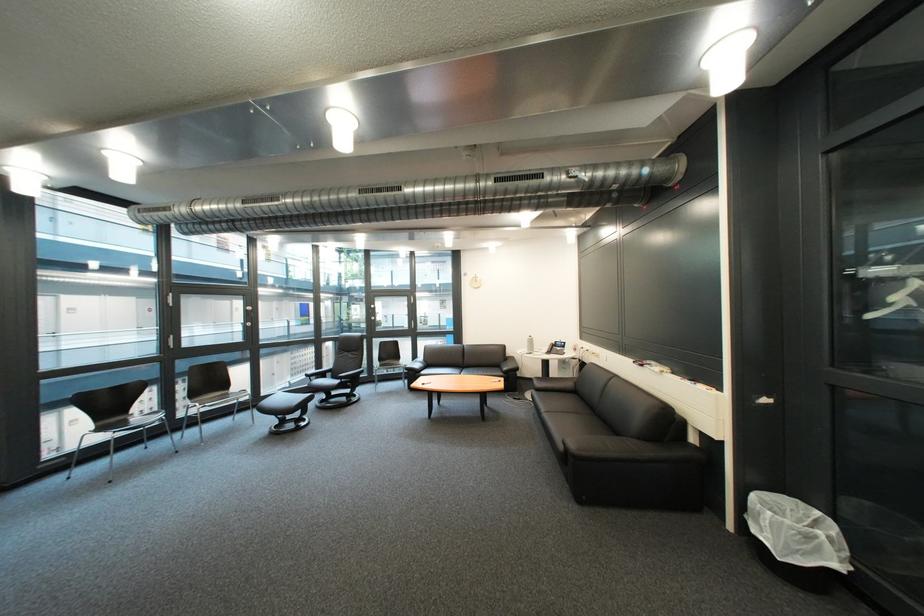
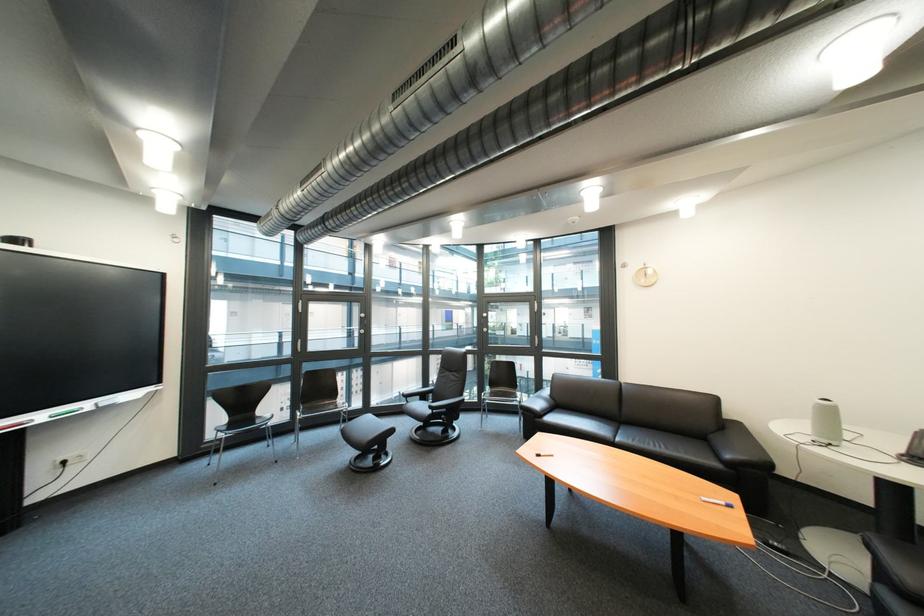
The point at (254, 411) is marked in the first image. Where is the corresponding point in the second image?

(359, 424)